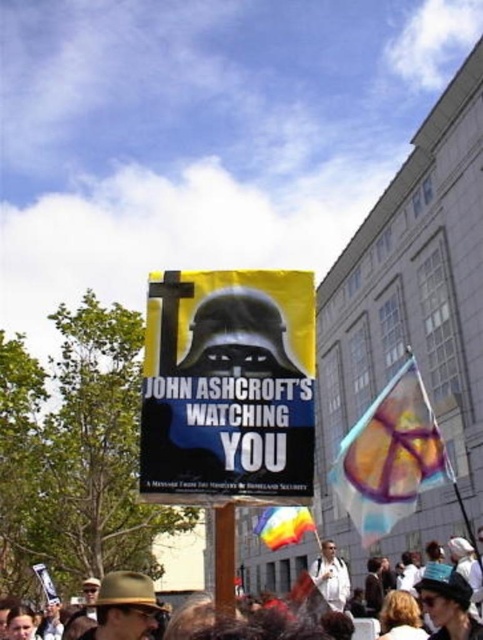
You are a photographer at the protest scene. You want to capture a photo where both the yellow paper poster at center and the white shirt at center are clearly visible. Given their sizes, which object should you focus on to ensure both are in frame without cropping?

The yellow paper poster at center occupies less space than the white shirt at center. To ensure both are in frame without cropping, focus on the larger object, the white shirt at center, as it requires more space and will help frame the smaller poster appropriately.

You are a photographer trying to capture the yellow paper poster at center and the white cotton shirt at lower center in a single frame. Based on their sizes, which object would appear smaller in the photo?

The yellow paper poster at center appears smaller in the photo because it has a lesser height compared to the white cotton shirt at lower center.